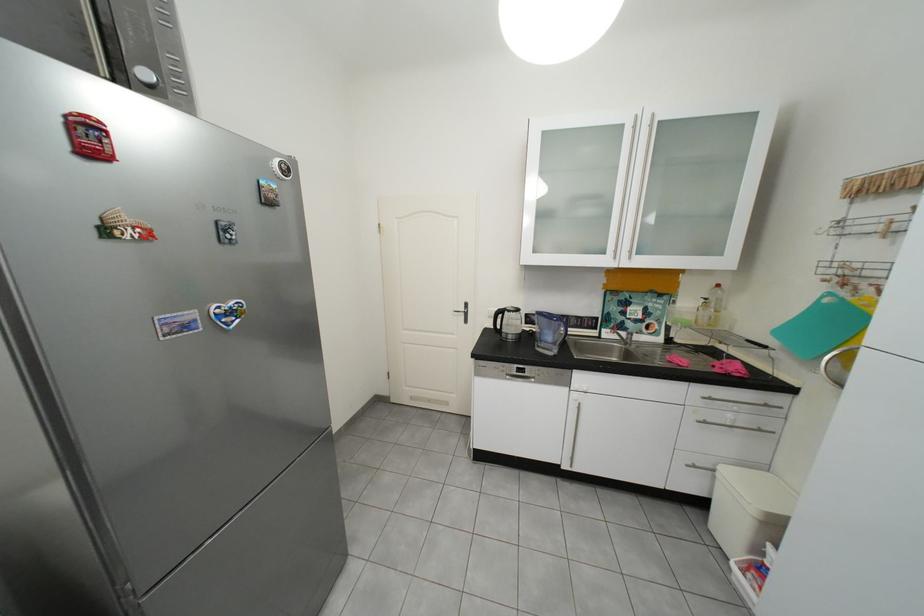
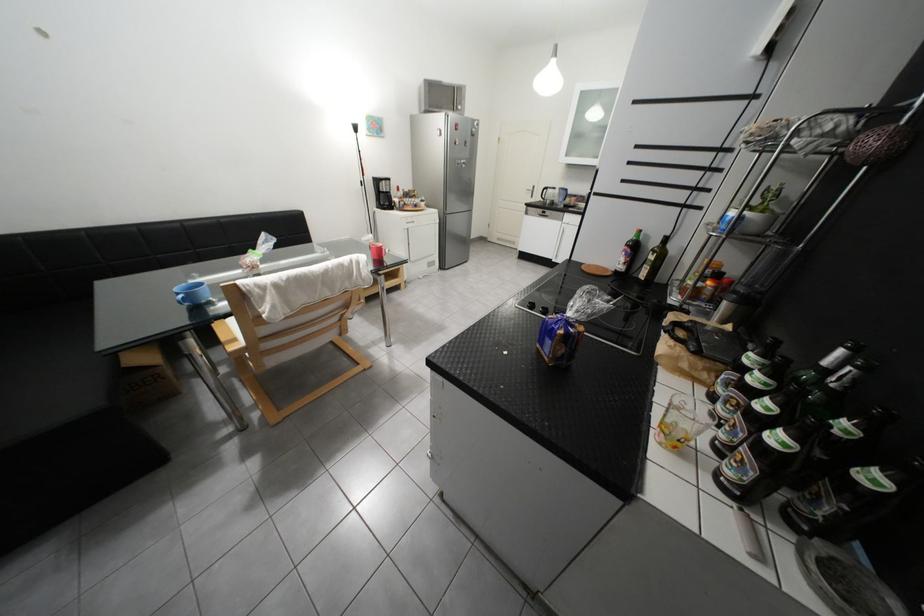
Where in the second image is the point corresponding to pixel 513 313 from the first image?

(557, 190)